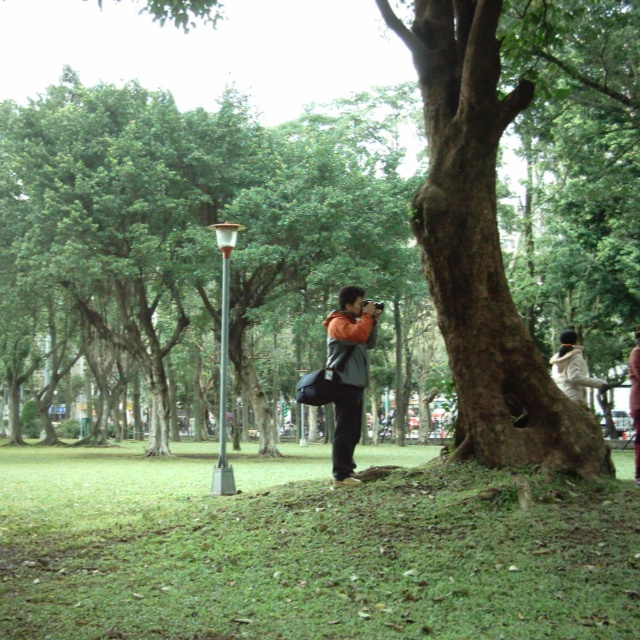
You are planning to take a photo of two people wearing jackets. The orange matte jacket at center and the white fleece jacket at lower right. Which jacket would you focus on if you want to capture the one with a slimmer silhouette?

The orange matte jacket at center is thinner than the white fleece jacket at lower right, so focusing on the orange matte jacket at center would capture the slimmer silhouette.

You are standing at point (637, 349) and want to walk to point (225, 433). Is the destination point behind you or in front of you?

The destination point (225, 433) is behind you because it is located behind point (637, 349).